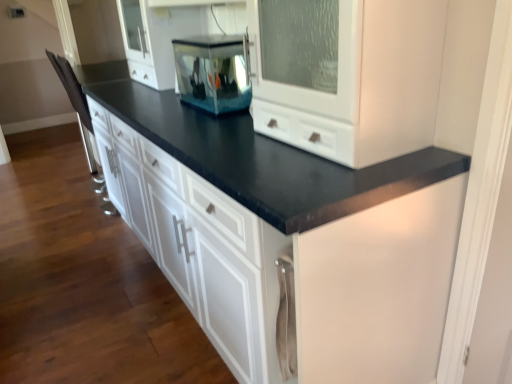
Image resolution: width=512 pixels, height=384 pixels. What do you see at coordinates (213, 72) in the screenshot?
I see `transparent glass fish tank at center` at bounding box center [213, 72].

Identify the location of transparent glass fish tank at center. (213, 72).

Image resolution: width=512 pixels, height=384 pixels. Find the location of `matte black countertop at center`. matte black countertop at center is located at coordinates (298, 261).

Describe the element at coordinates (298, 261) in the screenshot. This screenshot has width=512, height=384. I see `matte black countertop at center` at that location.

The image size is (512, 384). I want to click on transparent glass fish tank at center, so click(x=213, y=72).

Considering the positions of objects transparent glass fish tank at center and matte black countertop at center in the image provided, who is more to the left, transparent glass fish tank at center or matte black countertop at center?

matte black countertop at center is more to the left.

Which object is more forward, transparent glass fish tank at center or matte black countertop at center?

matte black countertop at center is closer to the camera.

Between point (246, 92) and point (443, 162), which one is positioned in front?

The point (443, 162) is in front.

From the image's perspective, does transparent glass fish tank at center appear higher than matte black countertop at center?

Yes, from the image's perspective, transparent glass fish tank at center is above matte black countertop at center.

From a real-world perspective, between transparent glass fish tank at center and matte black countertop at center, who is vertically higher?

In real-world perspective, transparent glass fish tank at center is above.

Can you confirm if transparent glass fish tank at center is thinner than matte black countertop at center?

Indeed, transparent glass fish tank at center has a lesser width compared to matte black countertop at center.

Between transparent glass fish tank at center and matte black countertop at center, which one has more height?

With more height is matte black countertop at center.

Can you confirm if transparent glass fish tank at center is smaller than matte black countertop at center?

Yes.

Would you say transparent glass fish tank at center is inside or outside matte black countertop at center?

transparent glass fish tank at center is inside matte black countertop at center.

Are transparent glass fish tank at center and matte black countertop at center making contact?

No, transparent glass fish tank at center is not touching matte black countertop at center.

Is transparent glass fish tank at center oriented towards matte black countertop at center?

Yes.

This screenshot has height=384, width=512. I want to click on cabinetry that is in front of the transparent glass fish tank at center, so click(298, 261).

Considering the relative positions of matte black countertop at center and transparent glass fish tank at center in the image provided, is matte black countertop at center to the right of transparent glass fish tank at center from the viewer's perspective?

In fact, matte black countertop at center is to the left of transparent glass fish tank at center.

Considering the relative positions of matte black countertop at center and transparent glass fish tank at center in the image provided, is matte black countertop at center behind transparent glass fish tank at center?

No, the depth of matte black countertop at center is less than that of transparent glass fish tank at center.

Considering the positions of points (371, 382) and (224, 100), is point (371, 382) closer to camera compared to point (224, 100)?

Yes, point (371, 382) is in front of point (224, 100).

From the image's perspective, between matte black countertop at center and transparent glass fish tank at center, which one is located above?

transparent glass fish tank at center appears higher in the image.

From a real-world perspective, which is physically below, matte black countertop at center or transparent glass fish tank at center?

matte black countertop at center, from a real-world perspective.

Considering the relative sizes of matte black countertop at center and transparent glass fish tank at center in the image provided, is matte black countertop at center thinner than transparent glass fish tank at center?

No, matte black countertop at center is not thinner than transparent glass fish tank at center.

In terms of height, does matte black countertop at center look taller or shorter compared to transparent glass fish tank at center?

In the image, matte black countertop at center appears to be taller than transparent glass fish tank at center.

Can you confirm if matte black countertop at center is bigger than transparent glass fish tank at center?

Yes, matte black countertop at center is bigger than transparent glass fish tank at center.

Would you say matte black countertop at center is inside or outside transparent glass fish tank at center?

matte black countertop at center exists outside the volume of transparent glass fish tank at center.

Is matte black countertop at center next to transparent glass fish tank at center?

matte black countertop at center is not next to transparent glass fish tank at center, and they're not touching.

Is matte black countertop at center oriented towards transparent glass fish tank at center?

Yes, matte black countertop at center is turned towards transparent glass fish tank at center.

How many degrees apart are the facing directions of matte black countertop at center and transparent glass fish tank at center?

matte black countertop at center and transparent glass fish tank at center are facing 0.994 degrees away from each other.

Measure the distance between matte black countertop at center and transparent glass fish tank at center.

matte black countertop at center is 25.03 inches away from transparent glass fish tank at center.

The height and width of the screenshot is (384, 512). I want to click on cabinetry in front of the transparent glass fish tank at center, so click(x=298, y=261).

Locate an element on the screen. The image size is (512, 384). appliance that is on the right side of matte black countertop at center is located at coordinates click(x=213, y=72).

Where is `appliance above the matte black countertop at center (from a real-world perspective)`? The height and width of the screenshot is (384, 512). appliance above the matte black countertop at center (from a real-world perspective) is located at coordinates (213, 72).